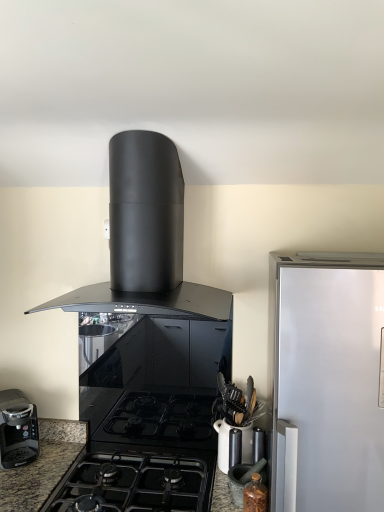
Question: Relative to brown glass jar at lower right, acting as the 4th kitchen appliance starting from the left, is black matte/glossy gas stove at center in front or behind?

Choices:
 (A) front
 (B) behind

Answer: (A)

Question: Is black matte/glossy gas stove at center to the left or to the right of brown glass jar at lower right, the first kitchen appliance in the bottom-to-top sequence, in the image?

Choices:
 (A) right
 (B) left

Answer: (B)

Question: Estimate the real-world distances between objects in this image. Which object is farther from the translucent glass jar at lower right?

Choices:
 (A) brown glass jar at lower right, acting as the 4th kitchen appliance starting from the left
 (B) black plastic coffee maker at lower left, arranged as the 2th kitchen appliance when viewed from the top
 (C) matte black mortar and pestle at lower right, placed as the 3th kitchen appliance when sorted from left to right
 (D) black matte range hood at upper center, placed as the 4th kitchen appliance when sorted from bottom to top
 (E) black matte/glossy gas stove at center

Answer: (B)

Question: Based on their relative distances, which object is nearer to the translucent glass jar at lower right?

Choices:
 (A) brown glass jar at lower right, acting as the 4th kitchen appliance starting from the left
 (B) matte black mortar and pestle at lower right, placed as the 3th kitchen appliance when sorted from left to right
 (C) black matte range hood at upper center, arranged as the second kitchen appliance when viewed from the left
 (D) black matte/glossy gas stove at center
 (E) black plastic coffee maker at lower left, which is the 3th kitchen appliance from bottom to top

Answer: (B)